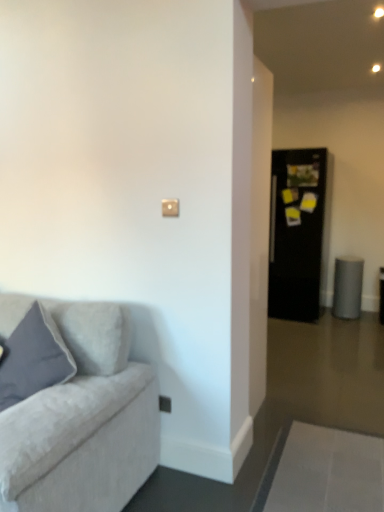
Question: Can you confirm if satin silver outlet at lower center is smaller than matte gray pillow at left?

Choices:
 (A) no
 (B) yes

Answer: (B)

Question: Considering the relative sizes of satin silver outlet at lower center and matte gray pillow at left in the image provided, is satin silver outlet at lower center wider than matte gray pillow at left?

Choices:
 (A) yes
 (B) no

Answer: (B)

Question: Would you say satin silver outlet at lower center contains matte gray pillow at left?

Choices:
 (A) yes
 (B) no

Answer: (B)

Question: From the image's perspective, is satin silver outlet at lower center on top of matte gray pillow at left?

Choices:
 (A) yes
 (B) no

Answer: (B)

Question: Does satin silver outlet at lower center have a larger size compared to matte gray pillow at left?

Choices:
 (A) no
 (B) yes

Answer: (A)

Question: From the image's perspective, relative to matte gray pillow at left, is black glossy refrigerator at right above or below?

Choices:
 (A) above
 (B) below

Answer: (A)

Question: Considering their positions, is black glossy refrigerator at right located in front of or behind matte gray pillow at left?

Choices:
 (A) front
 (B) behind

Answer: (B)

Question: Is black glossy refrigerator at right wider or thinner than matte gray pillow at left?

Choices:
 (A) thin
 (B) wide

Answer: (B)

Question: From a real-world perspective, is black glossy refrigerator at right positioned above or below matte gray pillow at left?

Choices:
 (A) above
 (B) below

Answer: (A)

Question: From a real-world perspective, relative to matte gray pillow at left, is satin silver outlet at lower center vertically above or below?

Choices:
 (A) above
 (B) below

Answer: (B)

Question: In the image, is satin silver outlet at lower center positioned in front of or behind matte gray pillow at left?

Choices:
 (A) behind
 (B) front

Answer: (A)

Question: Based on their sizes in the image, would you say satin silver outlet at lower center is bigger or smaller than matte gray pillow at left?

Choices:
 (A) small
 (B) big

Answer: (A)

Question: Is point (160, 401) positioned closer to the camera than point (49, 324)?

Choices:
 (A) closer
 (B) farther

Answer: (B)

Question: In the image, is satin silver outlet at lower center positioned in front of or behind matte beige switch at upper center?

Choices:
 (A) front
 (B) behind

Answer: (B)

Question: From the image's perspective, is satin silver outlet at lower center above or below matte beige switch at upper center?

Choices:
 (A) below
 (B) above

Answer: (A)